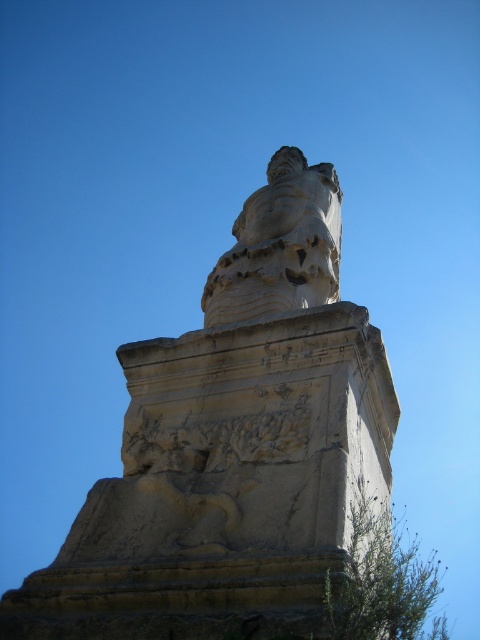
Question: Does white stone statue at center appear over white marble bust at center?

Choices:
 (A) yes
 (B) no

Answer: (B)

Question: Does white stone statue at center lie in front of white marble bust at center?

Choices:
 (A) no
 (B) yes

Answer: (B)

Question: Does white stone statue at center have a smaller size compared to white marble bust at center?

Choices:
 (A) yes
 (B) no

Answer: (B)